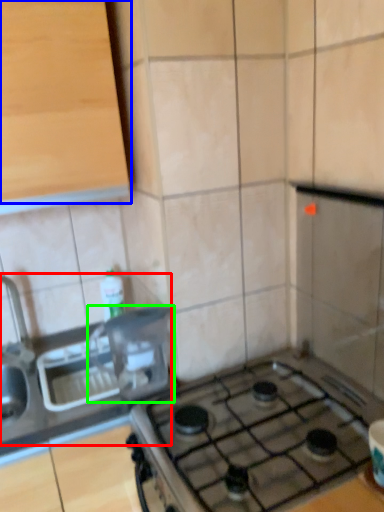
Question: Based on their relative distances, which object is farther from sink (highlighted by a red box)? Choose from cabinetry (highlighted by a blue box) and appliance (highlighted by a green box).

Choices:
 (A) cabinetry
 (B) appliance

Answer: (A)